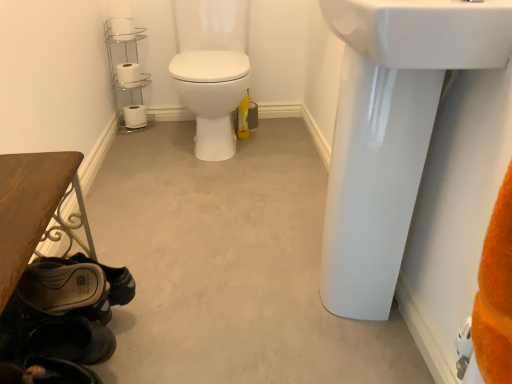
Question: Does dark brown leather shoe at lower left, the first shoe in the front-to-back sequence, appear on the right side of white matte toilet paper at upper left, placed as the second toilet paper when sorted from top to bottom?

Choices:
 (A) no
 (B) yes

Answer: (B)

Question: Is dark brown leather shoe at lower left, the first shoe in the front-to-back sequence, not near white matte toilet paper at upper left, the 2th toilet paper from the back?

Choices:
 (A) yes
 (B) no

Answer: (A)

Question: Are dark brown leather shoe at lower left, the first shoe in the front-to-back sequence, and white matte toilet paper at upper left, placed as the second toilet paper when sorted from top to bottom, beside each other?

Choices:
 (A) no
 (B) yes

Answer: (A)

Question: Is dark brown leather shoe at lower left, the second shoe when ordered from back to front, smaller than white matte toilet paper at upper left, placed as the second toilet paper when sorted from top to bottom?

Choices:
 (A) yes
 (B) no

Answer: (B)

Question: From a real-world perspective, is dark brown leather shoe at lower left, the second shoe when ordered from back to front, positioned under white matte toilet paper at upper left, the 2th toilet paper from the back, based on gravity?

Choices:
 (A) yes
 (B) no

Answer: (A)

Question: Considering the positions of white matte toilet paper at lower left, arranged as the 1th toilet paper when viewed from the back, and white matte toilet paper at upper left, which appears as the 1th toilet paper when viewed from the top, in the image, is white matte toilet paper at lower left, arranged as the 1th toilet paper when viewed from the back, bigger or smaller than white matte toilet paper at upper left, which appears as the 1th toilet paper when viewed from the top,?

Choices:
 (A) small
 (B) big

Answer: (B)

Question: Considering the relative positions of white matte toilet paper at lower left, which is counted as the third toilet paper, starting from the front, and white matte toilet paper at upper left, which is the 1th toilet paper in front-to-back order, in the image provided, is white matte toilet paper at lower left, which is counted as the third toilet paper, starting from the front, to the left or to the right of white matte toilet paper at upper left, which is the 1th toilet paper in front-to-back order,?

Choices:
 (A) right
 (B) left

Answer: (B)

Question: Is white matte toilet paper at lower left, arranged as the 1th toilet paper when viewed from the back, taller or shorter than white matte toilet paper at upper left, which is counted as the 3th toilet paper, starting from the back?

Choices:
 (A) short
 (B) tall

Answer: (B)

Question: Is white matte toilet paper at lower left, which is the 3th toilet paper from top to bottom, wider or thinner than white matte toilet paper at upper left, which is the 1th toilet paper in front-to-back order?

Choices:
 (A) thin
 (B) wide

Answer: (B)

Question: Considering the positions of dark brown leather shoe at lower left, the first shoe in the front-to-back sequence, and white matte toilet paper at upper left, positioned as the second toilet paper in front-to-back order, in the image, is dark brown leather shoe at lower left, the first shoe in the front-to-back sequence, taller or shorter than white matte toilet paper at upper left, positioned as the second toilet paper in front-to-back order,?

Choices:
 (A) tall
 (B) short

Answer: (A)

Question: From a real-world perspective, relative to white matte toilet paper at upper left, placed as the second toilet paper when sorted from top to bottom, is dark brown leather shoe at lower left, the second shoe when ordered from back to front, vertically above or below?

Choices:
 (A) above
 (B) below

Answer: (B)

Question: Looking at their shapes, would you say dark brown leather shoe at lower left, the first shoe in the front-to-back sequence, is wider or thinner than white matte toilet paper at upper left, positioned as the second toilet paper in front-to-back order?

Choices:
 (A) wide
 (B) thin

Answer: (A)

Question: Looking at the image, does dark brown leather shoe at lower left, the second shoe when ordered from back to front, seem bigger or smaller compared to white matte toilet paper at upper left, placed as the second toilet paper when sorted from top to bottom?

Choices:
 (A) big
 (B) small

Answer: (A)

Question: Is leather brown shoe at lower left, marked as the 1th shoe in a back-to-front arrangement, bigger or smaller than chrome/metallic toilet paper holder at upper left?

Choices:
 (A) small
 (B) big

Answer: (A)

Question: From a real-world perspective, relative to chrome/metallic toilet paper holder at upper left, is leather brown shoe at lower left, marked as the 1th shoe in a back-to-front arrangement, vertically above or below?

Choices:
 (A) above
 (B) below

Answer: (B)